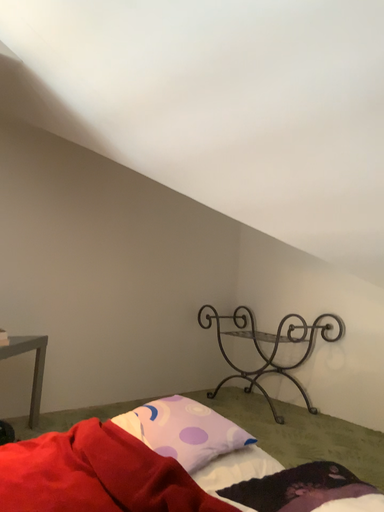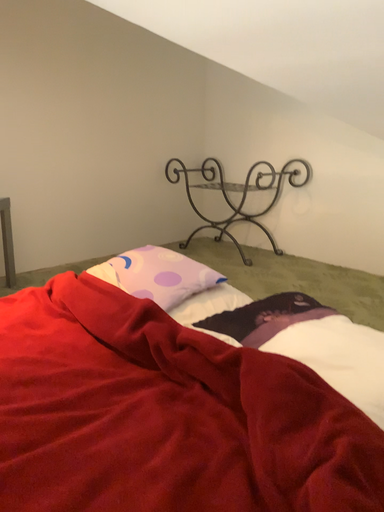
Question: How did the camera likely rotate when shooting the video?

Choices:
 (A) rotated upward
 (B) rotated downward

Answer: (B)